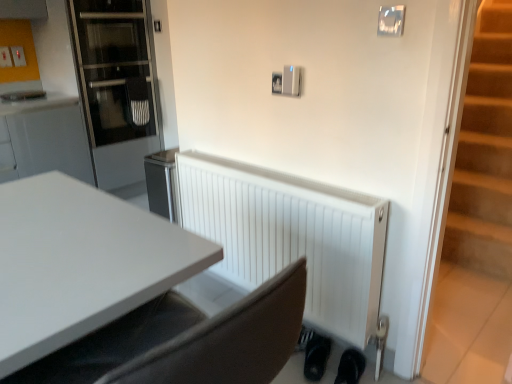
Question: From a real-world perspective, is black rubber shoe at lower right, the first shoe from the right, beneath black matte shoe at lower right, the second shoe positioned from the right?

Choices:
 (A) yes
 (B) no

Answer: (A)

Question: From a real-world perspective, is black rubber shoe at lower right, the first shoe from the right, physically above black matte shoe at lower right, positioned as the 1th shoe in left-to-right order?

Choices:
 (A) yes
 (B) no

Answer: (B)

Question: From the image's perspective, does black rubber shoe at lower right, which appears as the second shoe when viewed from the left, appear lower than black matte shoe at lower right, positioned as the 1th shoe in left-to-right order?

Choices:
 (A) yes
 (B) no

Answer: (A)

Question: From the image's perspective, does black rubber shoe at lower right, which appears as the second shoe when viewed from the left, appear higher than black matte shoe at lower right, positioned as the 1th shoe in left-to-right order?

Choices:
 (A) no
 (B) yes

Answer: (A)

Question: Is black rubber shoe at lower right, which appears as the second shoe when viewed from the left, outside black matte shoe at lower right, the second shoe positioned from the right?

Choices:
 (A) yes
 (B) no

Answer: (A)

Question: Relative to white matte radiator at lower center, is black matte shoe at lower right, the second shoe positioned from the right, in front or behind?

Choices:
 (A) behind
 (B) front

Answer: (A)

Question: In the image, is black matte shoe at lower right, positioned as the 1th shoe in left-to-right order, on the left side or the right side of white matte radiator at lower center?

Choices:
 (A) right
 (B) left

Answer: (A)

Question: Would you say black matte shoe at lower right, positioned as the 1th shoe in left-to-right order, is inside or outside white matte radiator at lower center?

Choices:
 (A) outside
 (B) inside

Answer: (B)

Question: From the image's perspective, is black matte shoe at lower right, positioned as the 1th shoe in left-to-right order, above or below white matte radiator at lower center?

Choices:
 (A) above
 (B) below

Answer: (B)

Question: Is point (316, 372) positioned closer to the camera than point (169, 230)?

Choices:
 (A) closer
 (B) farther

Answer: (B)

Question: Would you say black matte shoe at lower right, the second shoe positioned from the right, is to the left or to the right of white glossy desk at center in the picture?

Choices:
 (A) left
 (B) right

Answer: (B)

Question: From the image's perspective, relative to white glossy desk at center, is black matte shoe at lower right, positioned as the 1th shoe in left-to-right order, above or below?

Choices:
 (A) below
 (B) above

Answer: (A)

Question: Based on their sizes in the image, would you say black matte shoe at lower right, the second shoe positioned from the right, is bigger or smaller than white glossy desk at center?

Choices:
 (A) small
 (B) big

Answer: (A)

Question: From the image's perspective, is black rubber shoe at lower right, the first shoe from the right, located above or below black matte shoe at lower right, the second shoe positioned from the right?

Choices:
 (A) above
 (B) below

Answer: (B)

Question: Is black rubber shoe at lower right, which appears as the second shoe when viewed from the left, taller or shorter than black matte shoe at lower right, the second shoe positioned from the right?

Choices:
 (A) tall
 (B) short

Answer: (A)